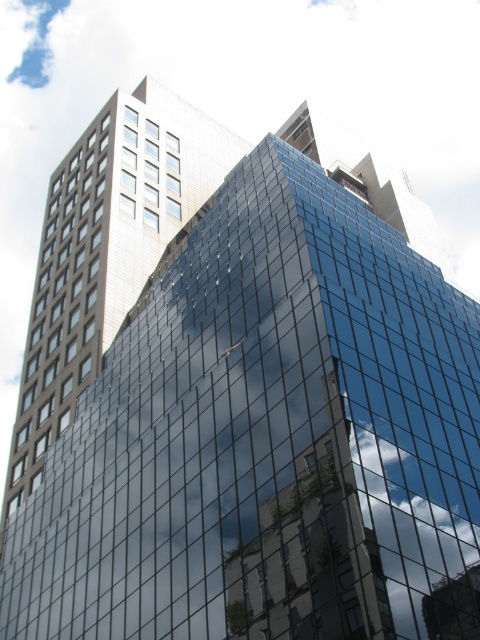
Question: Which point is farther from the camera taking this photo?

Choices:
 (A) (166, 164)
 (B) (33, 416)

Answer: (A)

Question: Can you confirm if clear glass windows at left is thinner than white glass windows at upper left?

Choices:
 (A) no
 (B) yes

Answer: (A)

Question: Which object is closer to the camera taking this photo?

Choices:
 (A) white glass windows at upper left
 (B) clear glass windows at left

Answer: (B)

Question: Can you confirm if clear glass windows at left is thinner than white glass windows at upper left?

Choices:
 (A) yes
 (B) no

Answer: (B)

Question: Does clear glass windows at left appear over white glass windows at upper left?

Choices:
 (A) yes
 (B) no

Answer: (B)